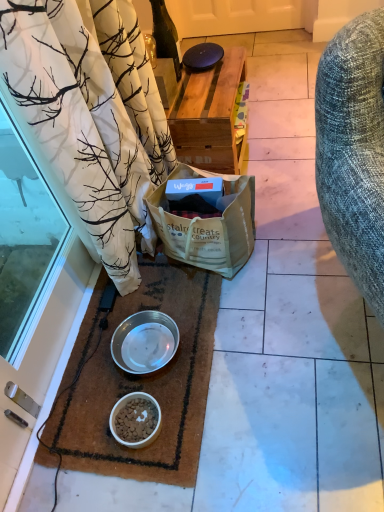
Where is `vacant space behind white matte bowl at lower center, placed as the first bowl when sorted from bottom to top`? Image resolution: width=384 pixels, height=512 pixels. vacant space behind white matte bowl at lower center, placed as the first bowl when sorted from bottom to top is located at coordinates (112, 379).